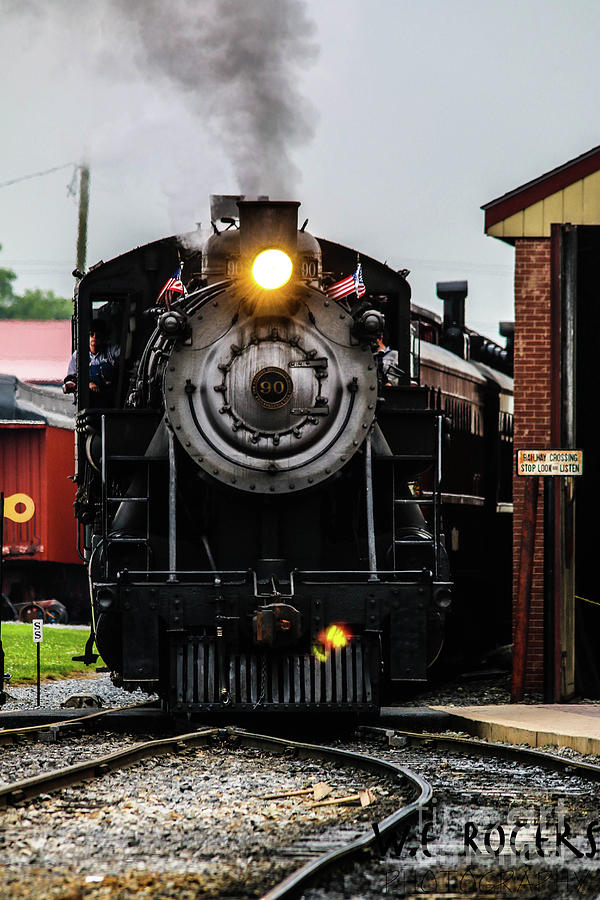
At what (x,y) coordinates should I click in order to perform the action: click on footboard hand rail. Please return your answer as a coordinate pair (x, y). Image resolution: width=600 pixels, height=900 pixels. Looking at the image, I should click on (414, 544), (138, 536).